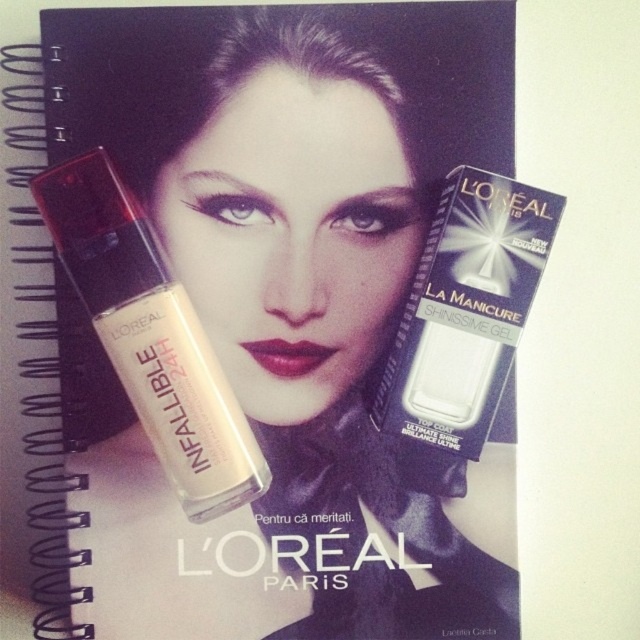
Question: Does matte plastic foundation at center appear on the left side of matte pink lipstick at center?

Choices:
 (A) yes
 (B) no

Answer: (A)

Question: Does shiny gel nail polish at upper right appear under matte pink lipstick at center?

Choices:
 (A) no
 (B) yes

Answer: (A)

Question: Which point is closer to the camera taking this photo?

Choices:
 (A) (240, 344)
 (B) (138, 372)
 (C) (490, 397)

Answer: (B)

Question: Which point is farther from the camera taking this photo?

Choices:
 (A) (412, 426)
 (B) (208, 467)
 (C) (288, 356)

Answer: (C)

Question: Is matte plastic foundation at center below matte pink lipstick at center?

Choices:
 (A) no
 (B) yes

Answer: (A)

Question: Which object is the farthest from the matte plastic foundation at center?

Choices:
 (A) shiny gel nail polish at upper right
 (B) matte pink lipstick at center

Answer: (A)